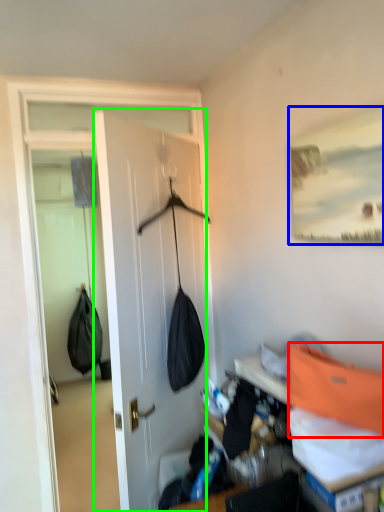
Question: Considering the real-world distances, which object is closest to shoulder bag (highlighted by a red box)? picture frame (highlighted by a blue box) or door (highlighted by a green box).

Choices:
 (A) picture frame
 (B) door

Answer: (A)